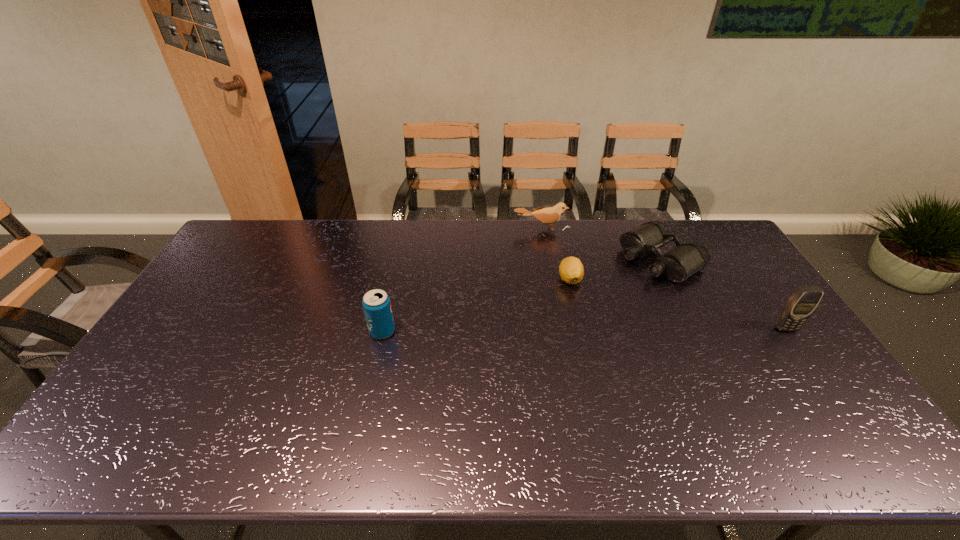
This screenshot has height=540, width=960. In order to click on soda can in this screenshot , I will do point(376,303).

Locate an element on the screen. The image size is (960, 540). the leftmost object is located at coordinates (376, 303).

Find the location of `the rightmost object`. the rightmost object is located at coordinates (802, 303).

Find the location of a particular element. The image size is (960, 540). the shortest object is located at coordinates (571, 270).

The width and height of the screenshot is (960, 540). What are the coordinates of `the second shortest object` in the screenshot? It's located at coord(678,264).

Locate an element on the screen. This screenshot has width=960, height=540. binoculars is located at coordinates click(x=678, y=264).

Locate an element on the screen. Image resolution: width=960 pixels, height=540 pixels. the farthest object is located at coordinates (550, 215).

The width and height of the screenshot is (960, 540). I want to click on the third tallest object, so click(x=550, y=215).

The width and height of the screenshot is (960, 540). What are the coordinates of `vacant space located on the right of the fourth shortest object` in the screenshot? It's located at (425, 332).

Locate an element on the screen. free region located 0.210m on the front face of the cellular telephone is located at coordinates (831, 394).